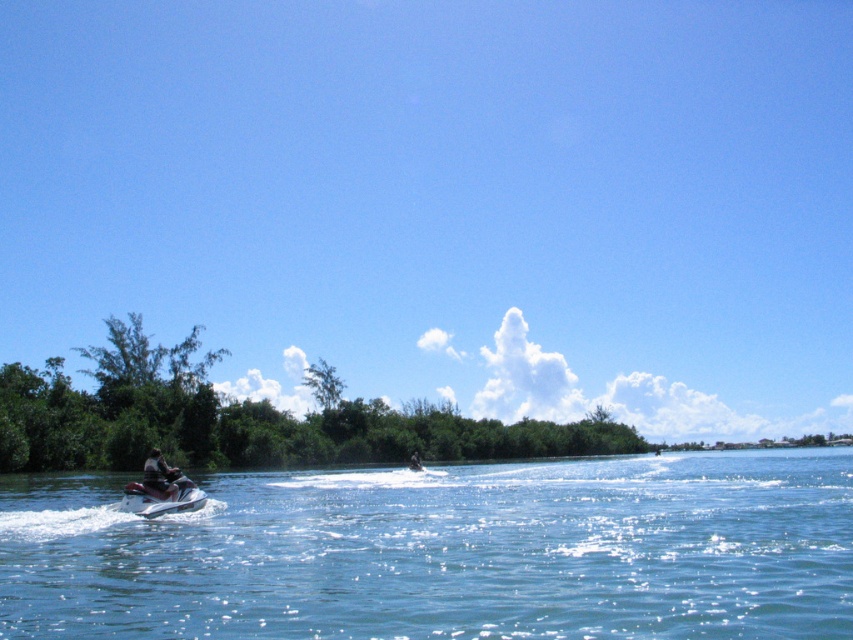
Question: Which object appears closest to the camera in this image?

Choices:
 (A) blue sky at upper center
 (B) metallic silver jet ski at lower left

Answer: (B)

Question: Can you confirm if metallic silver jet ski at lower left is bigger than dark brown leather jacket at center?

Choices:
 (A) no
 (B) yes

Answer: (B)

Question: Is white matte jet ski at lower left bigger than green leafy tree at center?

Choices:
 (A) no
 (B) yes

Answer: (A)

Question: Which object is closer to the camera taking this photo?

Choices:
 (A) blue sky at upper center
 (B) clear blue water at center
 (C) metallic silver jet ski at lower left

Answer: (B)

Question: In this image, where is clear blue water at center located relative to white matte jet ski at lower left?

Choices:
 (A) below
 (B) above

Answer: (A)

Question: Which point is closer to the camera taking this photo?

Choices:
 (A) (158, 449)
 (B) (318, 397)

Answer: (A)